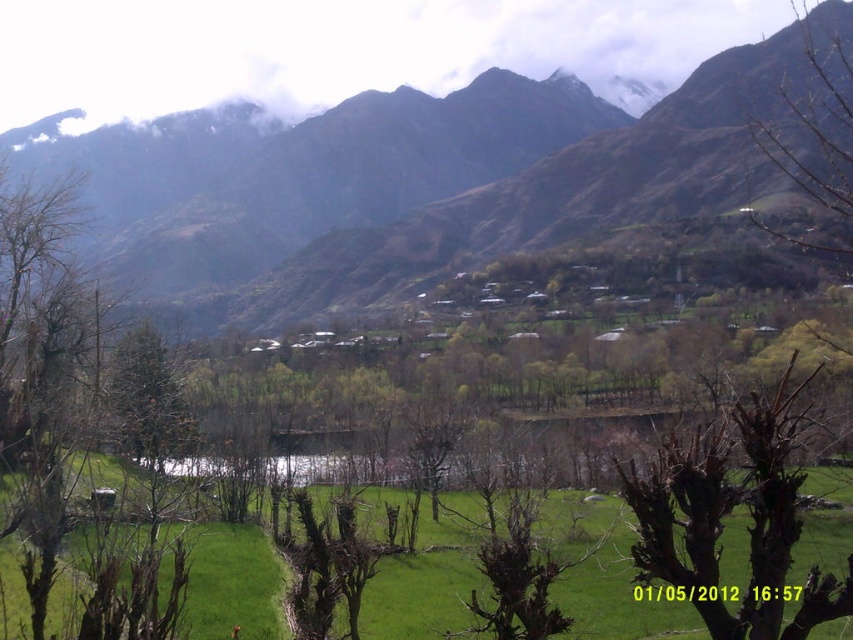
Which is more to the left, brown rocky mountains at center or bare branches at upper right?

brown rocky mountains at center is more to the left.

Which is behind, point (366, 294) or point (845, 180)?

Positioned behind is point (366, 294).

Where is `brown rocky mountains at center`? This screenshot has width=853, height=640. brown rocky mountains at center is located at coordinates (456, 188).

Is brown dry branches at lower right positioned at the back of bare branches at upper right?

No, brown dry branches at lower right is closer to the viewer.

Which is below, brown dry branches at lower right or bare branches at upper right?

brown dry branches at lower right is lower down.

You are a GUI agent. You are given a task and a screenshot of the screen. Output one action in this format:
    pyautogui.click(x=<x>, y=<y>)
    Task: Click on the brown dry branches at lower right
    The width and height of the screenshot is (853, 640).
    Given the screenshot: What is the action you would take?
    pyautogui.click(x=728, y=513)

Who is more distant from viewer, (109, 572) or (786, 173)?

The point (786, 173) is behind.

The height and width of the screenshot is (640, 853). Identify the location of green leafy tree at left. (44, 372).

Image resolution: width=853 pixels, height=640 pixels. What are the coordinates of `green leafy tree at left` in the screenshot? It's located at (44, 372).

Image resolution: width=853 pixels, height=640 pixels. I want to click on green leafy tree at left, so click(x=44, y=372).